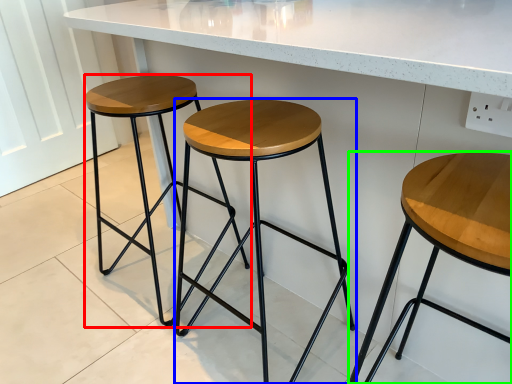
Question: Based on their relative distances, which object is nearer to stool (highlighted by a red box)? Choose from stool (highlighted by a blue box) and stool (highlighted by a green box).

Choices:
 (A) stool
 (B) stool

Answer: (A)